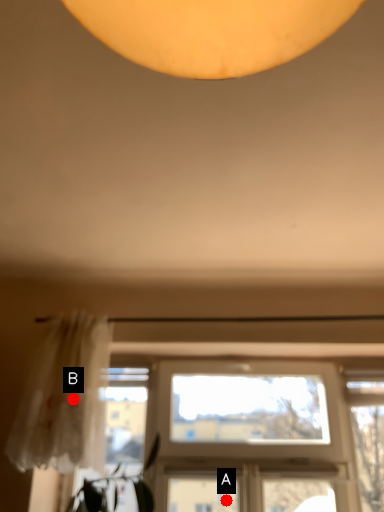
Question: Two points are circled on the image, labeled by A and B beside each circle. Which point is further to the camera?

Choices:
 (A) A is further
 (B) B is further

Answer: (A)